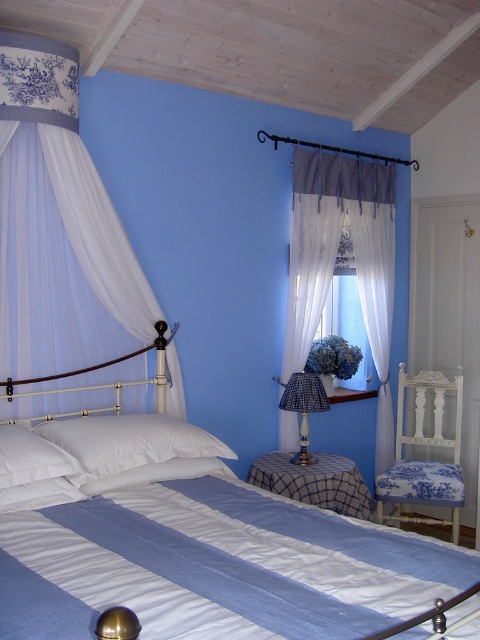
You are standing in the center of the bedroom and want to open the white sheer curtain at center. Which direction should you move to reach it?

The white sheer curtain at center is located at point (335,259), so you should move towards the right side of the room to reach it.

You are standing in the center of the bedroom and want to open the white sheer curtain at upper left. Based on its 2D coordinates, in which direction should you move to reach it?

The white sheer curtain at upper left is located at coordinates point (59, 227), so you should move towards the left and upward direction to reach it.